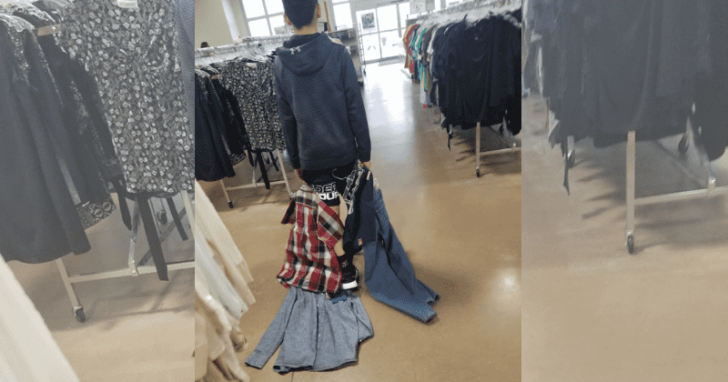
I want to click on windows, so click(x=253, y=13).